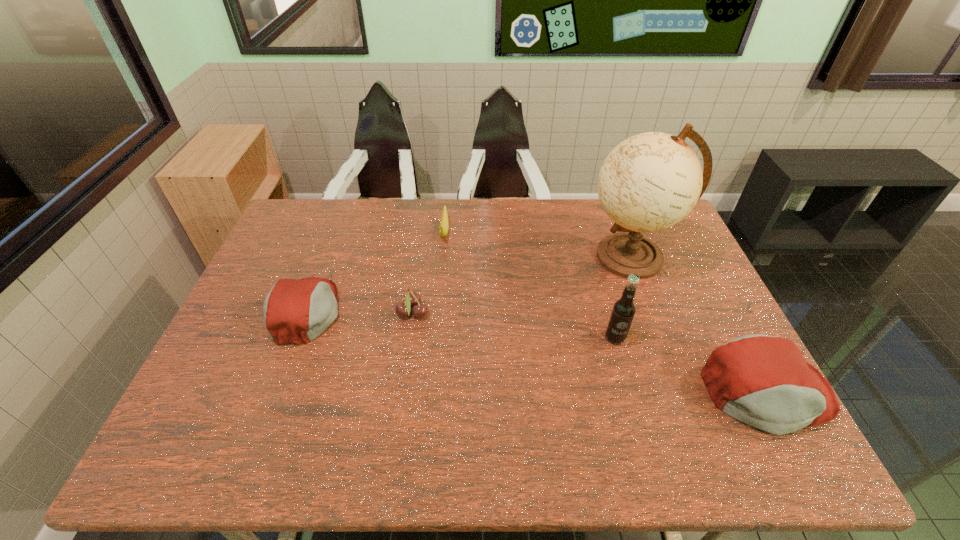
If equal spacing is the goal by inserting an additional cap_(headwear) among them, please point out a vacant space for this new cap_(headwear). Please provide its 2D coordinates. Your answer should be formatted as a tuple, i.e. [(x, y)], where the tuple contains the x and y coordinates of a point satisfying the conditions above.

[(518, 349)]